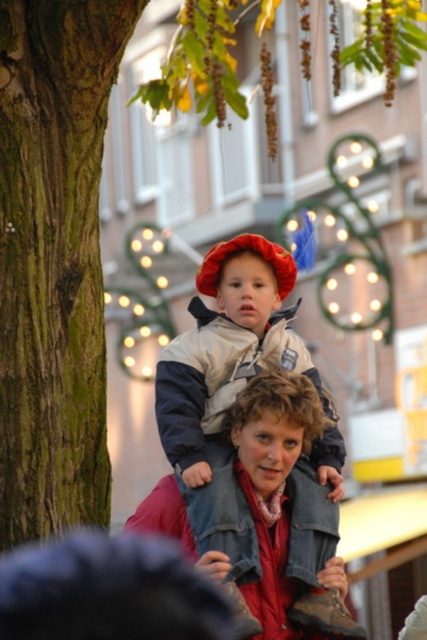
You are standing at the point with coordinates point (x=204, y=260) and want to move towards point (x=93, y=534). Given that you can only move forward, will you get closer to or farther from the festive building facade with windows behind the woman and child?

Since point (x=204, y=260) is further to the viewer than point (x=93, y=534), moving forward from point (x=204, y=260) towards point (x=93, y=534) will bring you closer to the festive building facade with windows behind the woman and child.

You are standing in front of the festive scene and notice the black fuzzy hat at upper center. Can you determine if the hat is closer to the tree trunk or the building facade?

The black fuzzy hat at upper center is located at point 0.923 in the x coordinate and 0.253 in the y coordinate. Since the tree trunk is on the left side and the building facade is behind the woman and child, the hat is closer to the building facade based on its position.

You are standing at the camera position and want to know how far the point at coordinates point (193,422) is from you. Can you determine the distance?

The distance of point (193,422) from camera is 65.27 meters, so the point is 65.27 meters away from you.